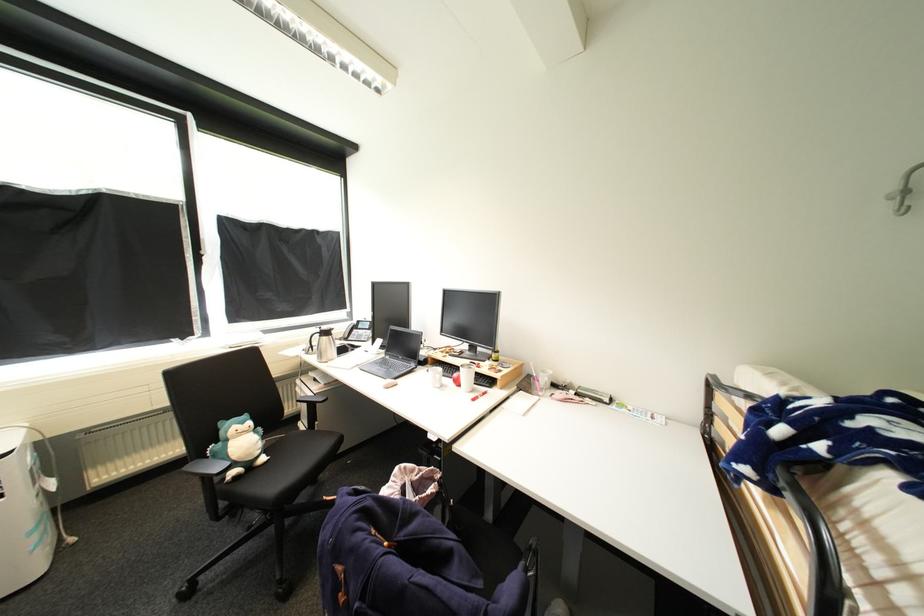
Where is `plush toy`? plush toy is located at coordinates (239, 445).